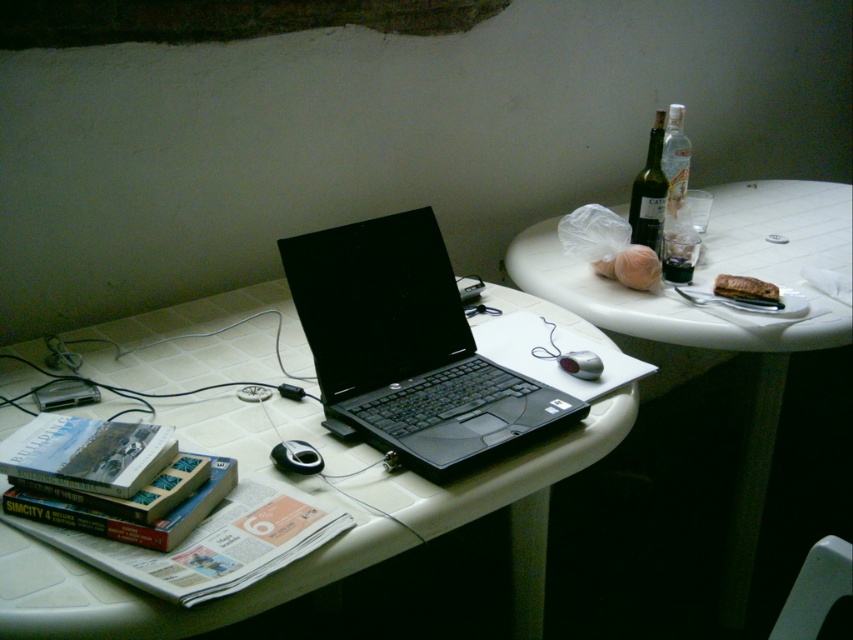
Question: Which of the following is the farthest from the observer?

Choices:
 (A) silver metallic mouse at center
 (B) white plastic plate at upper right

Answer: (B)

Question: Which point is closer to the camera taking this photo?

Choices:
 (A) (592, 364)
 (B) (769, 221)
 (C) (529, 451)

Answer: (C)

Question: Considering the real-world distances, which object is farthest from the green glass bottle at upper right?

Choices:
 (A) silver metallic mouse at center
 (B) clear glass bottle at upper right

Answer: (A)

Question: Can you confirm if black matte laptop at center is positioned below white plastic plate at upper right?

Choices:
 (A) yes
 (B) no

Answer: (A)

Question: Does black plastic laptop at center appear on the right side of green glass bottle at upper right?

Choices:
 (A) yes
 (B) no

Answer: (B)

Question: Is the position of clear glass bottle at upper right more distant than that of silver metallic mouse at center?

Choices:
 (A) no
 (B) yes

Answer: (B)